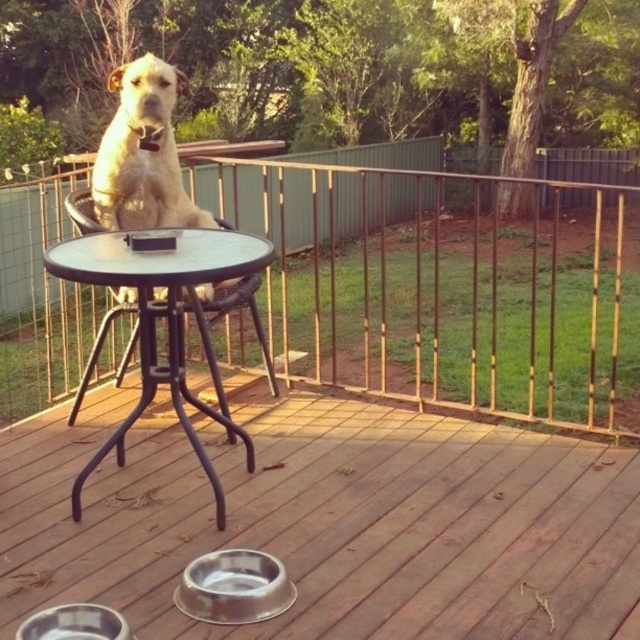
Is the position of black metal table at center less distant than that of white fur dog at center?

Yes.

From the picture: Between black metal table at center and white fur dog at center, which one appears on the right side from the viewer's perspective?

black metal table at center is more to the right.

Does point (214, 260) come behind point (140, 93)?

That is False.

This screenshot has height=640, width=640. In order to click on black metal table at center in this screenshot , I will do `click(166, 320)`.

Does metallic brown railing at upper center have a greater height compared to black metal table at center?

Correct, metallic brown railing at upper center is much taller as black metal table at center.

Does point (214, 339) come farther from viewer compared to point (120, 257)?

Yes, point (214, 339) is farther from viewer.

Is point (468, 371) in front of point (115, 244)?

No, (468, 371) is behind (115, 244).

This screenshot has height=640, width=640. I want to click on metallic brown railing at upper center, so click(445, 285).

Describe the element at coordinates (445, 285) in the screenshot. The height and width of the screenshot is (640, 640). I see `metallic brown railing at upper center` at that location.

Between metallic brown railing at upper center and white fur dog at center, which one is positioned lower?

Positioned lower is white fur dog at center.

At what (x,y) coordinates should I click in order to perform the action: click on metallic brown railing at upper center. Please return your answer as a coordinate pair (x, y). Looking at the image, I should click on (445, 285).